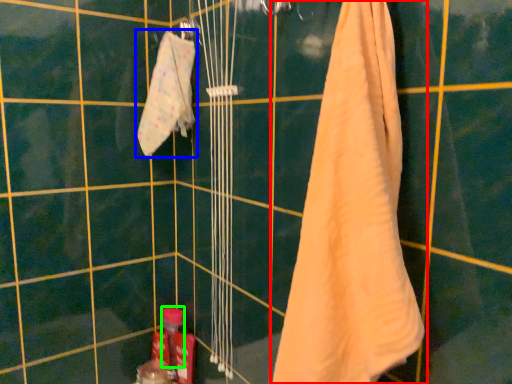
Question: Which is nearer to the towel (highlighted by a red box)? towel (highlighted by a blue box) or toiletry (highlighted by a green box).

Choices:
 (A) towel
 (B) toiletry

Answer: (A)